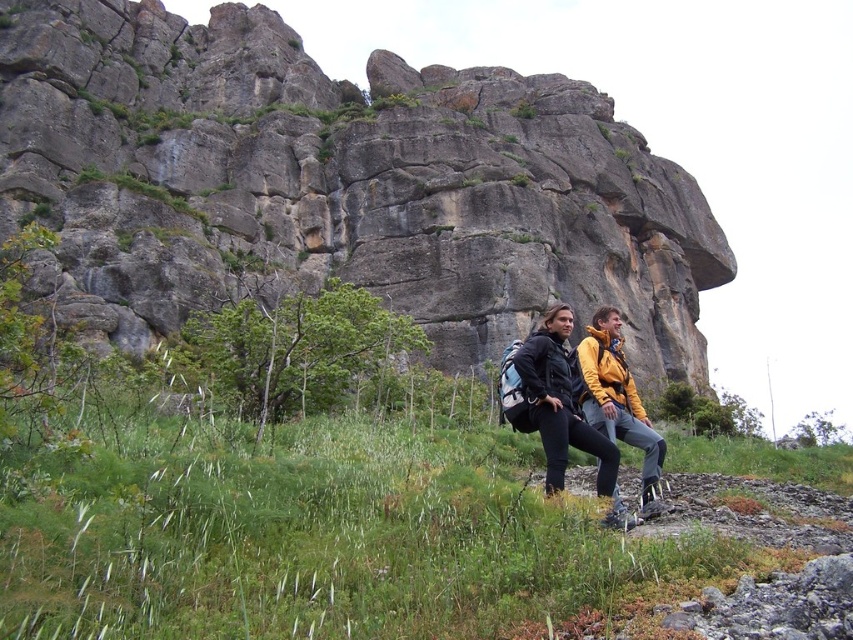
Which is in front, point (692, 557) or point (612, 388)?

Point (692, 557) is in front.

Is green grassy at lower center smaller than matte black jacket at center?

No.

This screenshot has height=640, width=853. Find the location of `green grassy at lower center`. green grassy at lower center is located at coordinates (302, 529).

Is gray rock formation at upper center below matte black jacket at center?

Actually, gray rock formation at upper center is above matte black jacket at center.

Can you confirm if gray rock formation at upper center is positioned to the left of matte black jacket at center?

Indeed, gray rock formation at upper center is positioned on the left side of matte black jacket at center.

Locate an element on the screen. The image size is (853, 640). gray rock formation at upper center is located at coordinates (335, 182).

Is gray rock formation at upper center wider than green grassy at lower center?

Indeed, gray rock formation at upper center has a greater width compared to green grassy at lower center.

Which is above, gray rock formation at upper center or green grassy at lower center?

Positioned higher is gray rock formation at upper center.

In the scene shown: Who is more forward, (125, 90) or (183, 561)?

Positioned in front is point (183, 561).

What are the coordinates of `gray rock formation at upper center` in the screenshot? It's located at (335, 182).